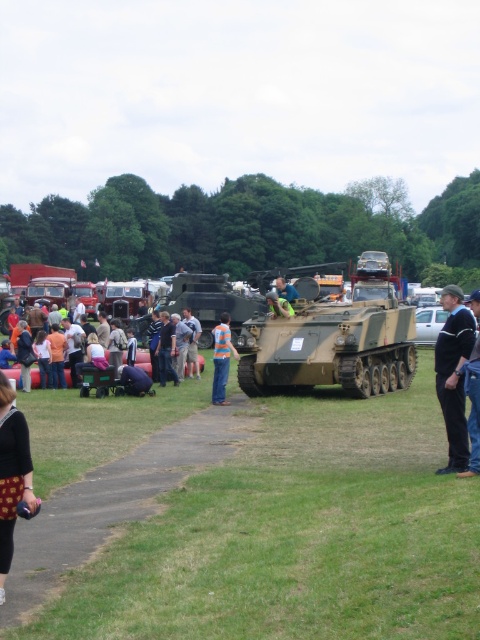
This screenshot has height=640, width=480. In order to click on camouflage matte tank at center in this screenshot , I will do `click(336, 340)`.

Between camouflage matte tank at center and blue striped shirt at center, which one has less height?

With less height is blue striped shirt at center.

The image size is (480, 640). Describe the element at coordinates (336, 340) in the screenshot. I see `camouflage matte tank at center` at that location.

Where is `camouflage matte tank at center`? The width and height of the screenshot is (480, 640). camouflage matte tank at center is located at coordinates (336, 340).

Can you confirm if black fabric jacket at center is smaller than orange shirt at center?

Incorrect, black fabric jacket at center is not smaller in size than orange shirt at center.

Can you confirm if black fabric jacket at center is shorter than orange shirt at center?

No, black fabric jacket at center is not shorter than orange shirt at center.

Does point (450, 458) come farther from viewer compared to point (191, 352)?

No, (450, 458) is closer to viewer.

Identify the location of black fabric jacket at center. (454, 374).

You are a GUI agent. You are given a task and a screenshot of the screen. Output one action in this format:
    pyautogui.click(x=<x>, y=<y>)
    Task: Click on the orange shirt at center
    The height and width of the screenshot is (640, 480).
    Given the screenshot: What is the action you would take?
    pyautogui.click(x=192, y=342)

Is orange shirt at center in front of green fabric jacket at center?

No, orange shirt at center is behind green fabric jacket at center.

Is point (191, 352) more distant than point (294, 310)?

That is True.

Locate an element on the screen. The image size is (480, 640). orange shirt at center is located at coordinates (192, 342).